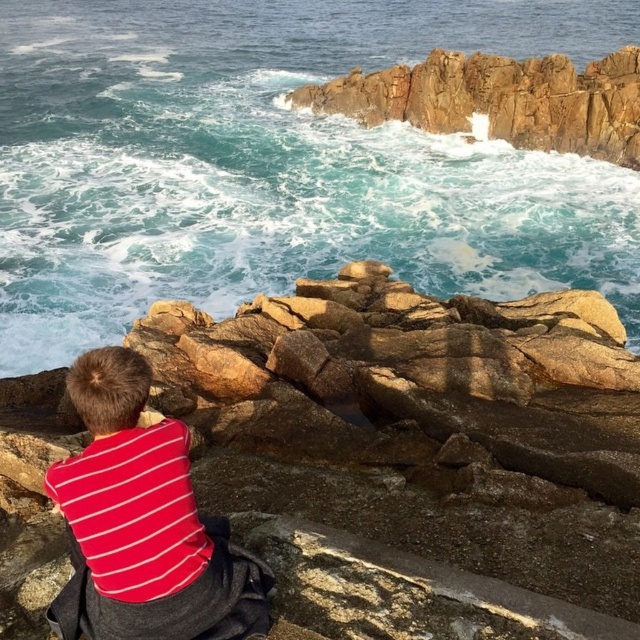
Does blue-green water at upper center have a lesser height compared to red striped shirt at lower left?

In fact, blue-green water at upper center may be taller than red striped shirt at lower left.

Who is taller, blue-green water at upper center or red striped shirt at lower left?

Standing taller between the two is blue-green water at upper center.

Measure the distance between blue-green water at upper center and camera.

blue-green water at upper center and camera are 14.45 meters apart.

Find the location of `blue-green water at upper center`. blue-green water at upper center is located at coordinates (276, 163).

From the picture: Can you confirm if brown rough rock at center is thinner than red striped shirt at lower left?

Yes.

Based on the photo, can you confirm if brown rough rock at center is positioned to the right of red striped shirt at lower left?

Indeed, brown rough rock at center is positioned on the right side of red striped shirt at lower left.

Where is `brown rough rock at center`? The image size is (640, 640). brown rough rock at center is located at coordinates (419, 451).

How much distance is there between blue-green water at upper center and brown rough rock at center?

blue-green water at upper center is 79.02 feet from brown rough rock at center.

Is point (625, 250) less distant than point (468, 480)?

No, it is behind (468, 480).

Does point (244, 298) lie in front of point (515, 582)?

No, (244, 298) is behind (515, 582).

Where is `blue-green water at upper center`? Image resolution: width=640 pixels, height=640 pixels. blue-green water at upper center is located at coordinates (276, 163).